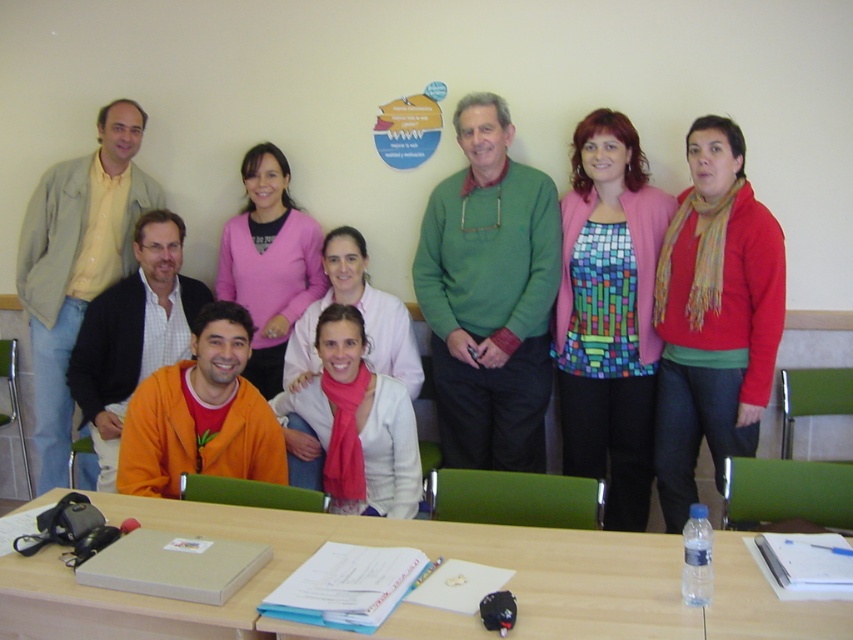
In the scene shown: You are organizing a photo shoot and need to ensure that the red matte sweater at center and the orange matte jacket at lower left are both visible in the frame. Based on their positions, which clothing item is closer to the camera?

The red matte sweater at center is closer to the camera because it is positioned over the orange matte jacket at lower left.